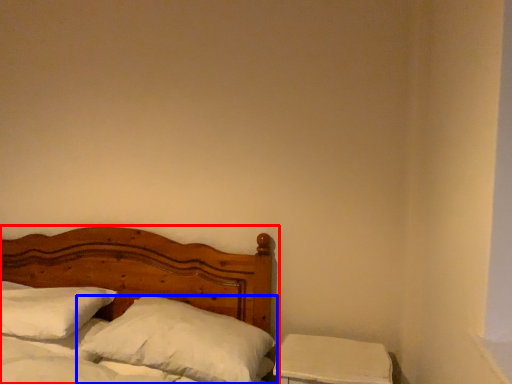
Question: Which of the following is the closest to the observer, bed (highlighted by a red box) or pillow (highlighted by a blue box)?

Choices:
 (A) bed
 (B) pillow

Answer: (A)